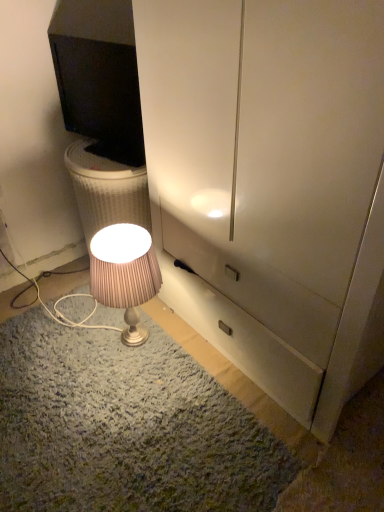
This screenshot has width=384, height=512. I want to click on black glossy monitor at upper left, so click(x=99, y=75).

What do you see at coordinates (99, 75) in the screenshot? This screenshot has width=384, height=512. I see `black glossy monitor at upper left` at bounding box center [99, 75].

This screenshot has height=512, width=384. Describe the element at coordinates (124, 274) in the screenshot. I see `matte silver lamp at lower center` at that location.

Where is `matte silver lamp at lower center`? matte silver lamp at lower center is located at coordinates (124, 274).

I want to click on black glossy monitor at upper left, so click(99, 75).

Is matte silver lamp at lower center at the right side of black glossy monitor at upper left?

Correct, you'll find matte silver lamp at lower center to the right of black glossy monitor at upper left.

In the image, is matte silver lamp at lower center positioned in front of or behind black glossy monitor at upper left?

matte silver lamp at lower center is positioned closer to the viewer than black glossy monitor at upper left.

Which is behind, point (131, 264) or point (87, 36)?

The point (87, 36) is farther.

From the image's perspective, between matte silver lamp at lower center and black glossy monitor at upper left, which one is located above?

From the image's view, black glossy monitor at upper left is above.

From a real-world perspective, does matte silver lamp at lower center sit lower than black glossy monitor at upper left?

Yes.

Considering the sizes of objects matte silver lamp at lower center and black glossy monitor at upper left in the image provided, who is wider, matte silver lamp at lower center or black glossy monitor at upper left?

matte silver lamp at lower center.

Is matte silver lamp at lower center shorter than black glossy monitor at upper left?

Incorrect, the height of matte silver lamp at lower center does not fall short of that of black glossy monitor at upper left.

Which of these two, matte silver lamp at lower center or black glossy monitor at upper left, is smaller?

black glossy monitor at upper left is smaller.

Is matte silver lamp at lower center positioned beyond the bounds of black glossy monitor at upper left?

Indeed, matte silver lamp at lower center is completely outside black glossy monitor at upper left.

Is matte silver lamp at lower center not close to black glossy monitor at upper left?

matte silver lamp at lower center is actually quite close to black glossy monitor at upper left.

Is matte silver lamp at lower center looking in the opposite direction of black glossy monitor at upper left?

matte silver lamp at lower center is not turned away from black glossy monitor at upper left.

How many degrees apart are the facing directions of matte silver lamp at lower center and black glossy monitor at upper left?

The angle between the facing direction of matte silver lamp at lower center and the facing direction of black glossy monitor at upper left is 17.8 degrees.

Where is `television located above the matte silver lamp at lower center (from a real-world perspective)`? television located above the matte silver lamp at lower center (from a real-world perspective) is located at coordinates (99, 75).

Is black glossy monitor at upper left to the left or to the right of matte silver lamp at lower center in the image?

black glossy monitor at upper left is to the left of matte silver lamp at lower center.

In the image, is black glossy monitor at upper left positioned in front of or behind matte silver lamp at lower center?

black glossy monitor at upper left is positioned farther from the viewer than matte silver lamp at lower center.

Which is in front, point (69, 33) or point (93, 240)?

The point (93, 240) is closer.

From the image's perspective, between black glossy monitor at upper left and matte silver lamp at lower center, which one is located above?

black glossy monitor at upper left is shown above in the image.

From a real-world perspective, is black glossy monitor at upper left positioned over matte silver lamp at lower center based on gravity?

Yes, from a real-world perspective, black glossy monitor at upper left is above matte silver lamp at lower center.

Is black glossy monitor at upper left wider than matte silver lamp at lower center?

No, black glossy monitor at upper left is not wider than matte silver lamp at lower center.

Considering the sizes of objects black glossy monitor at upper left and matte silver lamp at lower center in the image provided, who is shorter, black glossy monitor at upper left or matte silver lamp at lower center?

black glossy monitor at upper left.

Considering the relative sizes of black glossy monitor at upper left and matte silver lamp at lower center in the image provided, is black glossy monitor at upper left smaller than matte silver lamp at lower center?

Indeed, black glossy monitor at upper left has a smaller size compared to matte silver lamp at lower center.

Is black glossy monitor at upper left positioned beyond the bounds of matte silver lamp at lower center?

Yes, black glossy monitor at upper left is not within matte silver lamp at lower center.

Is black glossy monitor at upper left with matte silver lamp at lower center?

black glossy monitor at upper left is not next to matte silver lamp at lower center, and they're not touching.

Based on the photo, could you tell me if black glossy monitor at upper left is turned towards matte silver lamp at lower center?

No, black glossy monitor at upper left is not facing towards matte silver lamp at lower center.

How many degrees apart are the facing directions of black glossy monitor at upper left and matte silver lamp at lower center?

The angle between the facing direction of black glossy monitor at upper left and the facing direction of matte silver lamp at lower center is 17.8 degrees.

The image size is (384, 512). I want to click on lamp below the black glossy monitor at upper left (from a real-world perspective), so click(x=124, y=274).

Locate an element on the screen. The height and width of the screenshot is (512, 384). television on the left side of matte silver lamp at lower center is located at coordinates 99,75.

The image size is (384, 512). What are the coordinates of `lamp below the black glossy monitor at upper left (from the image's perspective)` in the screenshot? It's located at (124, 274).